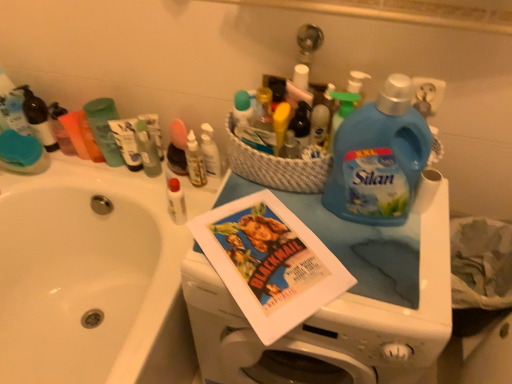
Identify the location of free space in front of green plastic shampoo bottle at upper left, which appears as the second toiletry when viewed from the right. (115, 183).